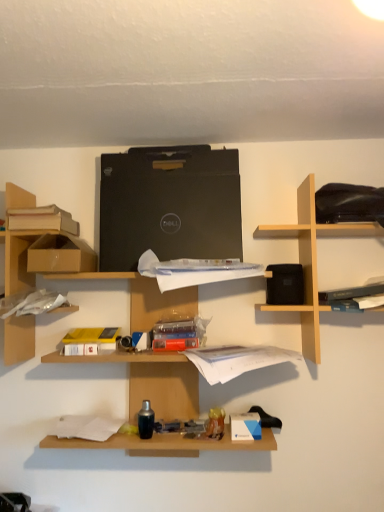
Locate an element on the screen. This screenshot has width=384, height=512. white paper at center, the 3th book in the top-to-bottom sequence is located at coordinates (237, 361).

Where is `black matte laptop at center`? Image resolution: width=384 pixels, height=512 pixels. black matte laptop at center is located at coordinates (169, 205).

In order to face brown cardboard boxes at left, the 1th shelf positioned from the left, should I rotate leftwards or rightwards?

Rotate left and turn 21.225 degrees.

This screenshot has width=384, height=512. Find the location of `hardcover book at upper right, the second book ordered from the bottom`. hardcover book at upper right, the second book ordered from the bottom is located at coordinates (355, 297).

What's the angular difference between hardcover book at upper right, which is counted as the 1th book, starting from the right, and brown cardboard boxes at left, the 1th shelf positioned from the left,'s facing directions?

hardcover book at upper right, which is counted as the 1th book, starting from the right, and brown cardboard boxes at left, the 1th shelf positioned from the left, are facing 2.37 degrees away from each other.

Identify the location of the 1st book located beneath the brown cardboard boxes at left, the second shelf when ordered from right to left (from a real-world perspective). (355, 297).

Considering their positions, is hardcover book at upper right, which appears as the 2th book when viewed from the top, located in front of or behind brown cardboard boxes at left, the second shelf when ordered from right to left?

Visually, hardcover book at upper right, which appears as the 2th book when viewed from the top, is located in front of brown cardboard boxes at left, the second shelf when ordered from right to left.

Is black matte laptop at center turned away from light wood/black speaker at upper right, the second shelf viewed from the left?

No, black matte laptop at center's orientation is not away from light wood/black speaker at upper right, the second shelf viewed from the left.

Identify the location of computer that appears on the left of light wood/black speaker at upper right, the first shelf viewed from the right. (169, 205).

What's the angular difference between black matte laptop at center and light wood/black speaker at upper right, the first shelf viewed from the right,'s facing directions?

2.46 degrees separate the facing orientations of black matte laptop at center and light wood/black speaker at upper right, the first shelf viewed from the right.

Is black matte laptop at center touching light wood/black speaker at upper right, the first shelf viewed from the right?

No, black matte laptop at center is not beside light wood/black speaker at upper right, the first shelf viewed from the right.

Would you consider brown cardboard boxes at left, the 1th shelf positioned from the left, to be distant from light wood/black speaker at upper right, the first shelf viewed from the right?

No, brown cardboard boxes at left, the 1th shelf positioned from the left, is not far from light wood/black speaker at upper right, the first shelf viewed from the right.

From the picture: Is light wood/black speaker at upper right, the second shelf viewed from the left, at the back of brown cardboard boxes at left, the second shelf when ordered from right to left?

No, brown cardboard boxes at left, the second shelf when ordered from right to left,'s orientation is not away from light wood/black speaker at upper right, the second shelf viewed from the left.

How many degrees apart are the facing directions of brown cardboard boxes at left, the 1th shelf positioned from the left, and light wood/black speaker at upper right, the first shelf viewed from the right?

There is a 0.858-degree angle between the facing directions of brown cardboard boxes at left, the 1th shelf positioned from the left, and light wood/black speaker at upper right, the first shelf viewed from the right.

Between brown cardboard boxes at left, the second shelf when ordered from right to left, and light wood/black speaker at upper right, the first shelf viewed from the right, which one has larger size?

light wood/black speaker at upper right, the first shelf viewed from the right.

What are the coordinates of `the 1st shelf in front of the black matte laptop at center, starting your count from the anchor` in the screenshot? It's located at (18, 258).

Is brown cardboard boxes at left, the second shelf when ordered from right to left, at the left side of black matte laptop at center?

Indeed, brown cardboard boxes at left, the second shelf when ordered from right to left, is positioned on the left side of black matte laptop at center.

Is brown cardboard boxes at left, the 1th shelf positioned from the left, further to camera compared to black matte laptop at center?

That is False.

Between point (376, 279) and point (78, 271), which one is positioned in front?

Positioned in front is point (78, 271).

How distant is hardcover book at upper right, acting as the 3th book starting from the left, from brown cardboard box at left?

The distance of hardcover book at upper right, acting as the 3th book starting from the left, from brown cardboard box at left is 32.99 inches.

From a real-world perspective, which is physically above, hardcover book at upper right, which appears as the 2th book when viewed from the top, or brown cardboard box at left?

brown cardboard box at left.

Does hardcover book at upper right, acting as the 3th book starting from the left, have a larger size compared to brown cardboard box at left?

No, hardcover book at upper right, acting as the 3th book starting from the left, is not bigger than brown cardboard box at left.

I want to click on the 1st book in front of the black matte laptop at center, starting your count from the anchor, so click(x=42, y=219).

In terms of size, does black matte laptop at center appear bigger or smaller than matte cardboard book at upper left, arranged as the first book when viewed from the top?

Considering their sizes, black matte laptop at center takes up more space than matte cardboard book at upper left, arranged as the first book when viewed from the top.

From the image's perspective, is black matte laptop at center above matte cardboard book at upper left, the 1th book from the left?

Yes, from the image's perspective, black matte laptop at center is above matte cardboard book at upper left, the 1th book from the left.

In the image, is matte cardboard book at upper left, the 3th book positioned from the right, positioned in front of or behind black matte laptop at center?

In the image, matte cardboard book at upper left, the 3th book positioned from the right, appears in front of black matte laptop at center.

The image size is (384, 512). I want to click on the 1st book in front of the black matte laptop at center, starting your count from the anchor, so click(x=42, y=219).

Is matte cardboard book at upper left, arranged as the first book when viewed from the top, not close to black matte laptop at center?

matte cardboard book at upper left, arranged as the first book when viewed from the top, is near black matte laptop at center, not far away.

At what (x,y) coordinates should I click in order to perform the action: click on the 2nd shelf counting from the left of the hardcover book at upper right, which appears as the 2th book when viewed from the top. Please return your answer as a coordinate pair (x, y). Looking at the image, I should click on (18, 258).

Identify the location of computer located above the light wood/black speaker at upper right, the first shelf viewed from the right (from a real-world perspective). (169, 205).

Considering their positions, is light wood/black speaker at upper right, the first shelf viewed from the right, positioned further to black matte laptop at center than hardcover book at upper right, the second book ordered from the bottom?

Among the two, hardcover book at upper right, the second book ordered from the bottom, is located further to black matte laptop at center.

Estimate the real-world distances between objects in this image. Which object is closer to brown cardboard boxes at left, the 1th shelf positioned from the left, black matte laptop at center or light wood/black speaker at upper right, the second shelf viewed from the left?

black matte laptop at center.

Looking at the image, which one is located closer to white paper at center, the 3th book in the top-to-bottom sequence, light wood/black speaker at upper right, the first shelf viewed from the right, or brown cardboard box at left?

The object closer to white paper at center, the 3th book in the top-to-bottom sequence, is light wood/black speaker at upper right, the first shelf viewed from the right.

Considering their positions, is hardcover book at upper right, which is counted as the 1th book, starting from the right, positioned closer to matte cardboard book at upper left, marked as the third book in a bottom-to-top arrangement, than black matte laptop at center?

black matte laptop at center is positioned closer to the anchor matte cardboard book at upper left, marked as the third book in a bottom-to-top arrangement.

Looking at the image, which one is located further to brown cardboard box at left, white paper at center, positioned as the 1th book in bottom-to-top order, or hardcover book at upper right, acting as the 3th book starting from the left?

hardcover book at upper right, acting as the 3th book starting from the left, is positioned further to the anchor brown cardboard box at left.

Looking at this image, which object lies further to the anchor point matte cardboard book at upper left, the 3th book positioned from the right, black matte laptop at center or hardcover book at upper right, acting as the 3th book starting from the left?

hardcover book at upper right, acting as the 3th book starting from the left, lies further to matte cardboard book at upper left, the 3th book positioned from the right, than the other object.

Looking at the image, which one is located further to matte cardboard book at upper left, the 1th book from the left, light wood/black speaker at upper right, the second shelf viewed from the left, or hardcover book at upper right, acting as the 3th book starting from the left?

hardcover book at upper right, acting as the 3th book starting from the left, is further to matte cardboard book at upper left, the 1th book from the left.

Estimate the real-world distances between objects in this image. Which object is closer to hardcover book at upper right, which is counted as the 1th book, starting from the right, light wood/black speaker at upper right, the first shelf viewed from the right, or white paper at center, positioned as the 1th book in bottom-to-top order?

light wood/black speaker at upper right, the first shelf viewed from the right, is closer to hardcover book at upper right, which is counted as the 1th book, starting from the right.

This screenshot has height=512, width=384. I want to click on computer between brown cardboard box at left and white paper at center, positioned as the 1th book in bottom-to-top order, in the horizontal direction, so click(x=169, y=205).

Where is `cardboard box located between brown cardboard boxes at left, the 1th shelf positioned from the left, and white paper at center, which is counted as the second book, starting from the left, in the left-right direction`? Image resolution: width=384 pixels, height=512 pixels. cardboard box located between brown cardboard boxes at left, the 1th shelf positioned from the left, and white paper at center, which is counted as the second book, starting from the left, in the left-right direction is located at coordinates (60, 255).

Locate an element on the screen. This screenshot has width=384, height=512. computer between matte cardboard book at upper left, arranged as the first book when viewed from the top, and light wood/black speaker at upper right, the first shelf viewed from the right, in the horizontal direction is located at coordinates (169, 205).

You are a GUI agent. You are given a task and a screenshot of the screen. Output one action in this format:
    pyautogui.click(x=<x>, y=<y>)
    Task: Click on the book between black matte laptop at center and hardcover book at upper right, acting as the 3th book starting from the left, from left to right
    This screenshot has width=384, height=512.
    Given the screenshot: What is the action you would take?
    pyautogui.click(x=237, y=361)